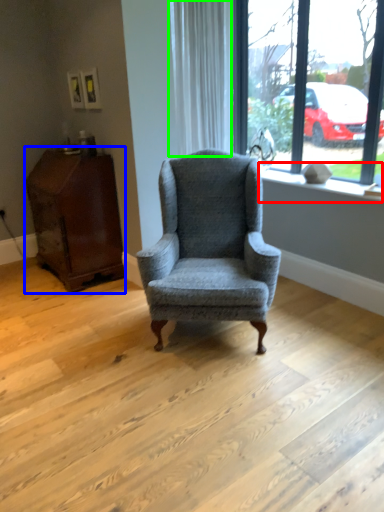
Question: Which object is the closest to the window sill (highlighted by a red box)? Choose among these: table (highlighted by a blue box) or curtain (highlighted by a green box).

Choices:
 (A) table
 (B) curtain

Answer: (B)